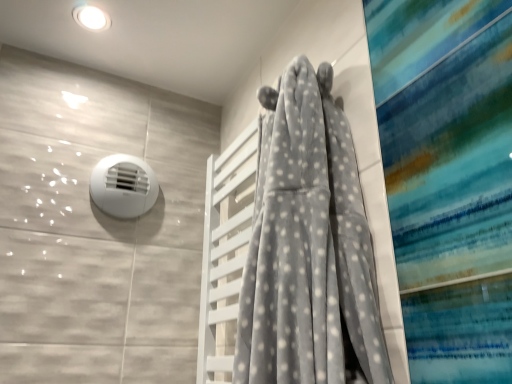
From the picture: Measure the distance between point (346, 300) and camera.

A distance of 24.06 inches exists between point (346, 300) and camera.

This screenshot has width=512, height=384. I want to click on gray polka dot fabric at center, so click(308, 247).

This screenshot has height=384, width=512. What do you see at coordinates (308, 247) in the screenshot?
I see `gray polka dot fabric at center` at bounding box center [308, 247].

Identify the location of gray polka dot fabric at center. This screenshot has width=512, height=384. (308, 247).